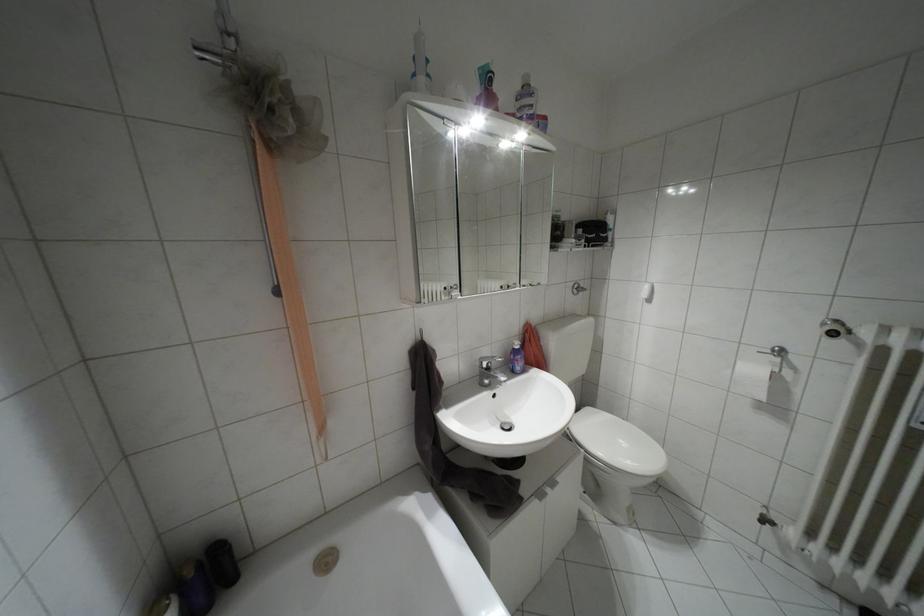
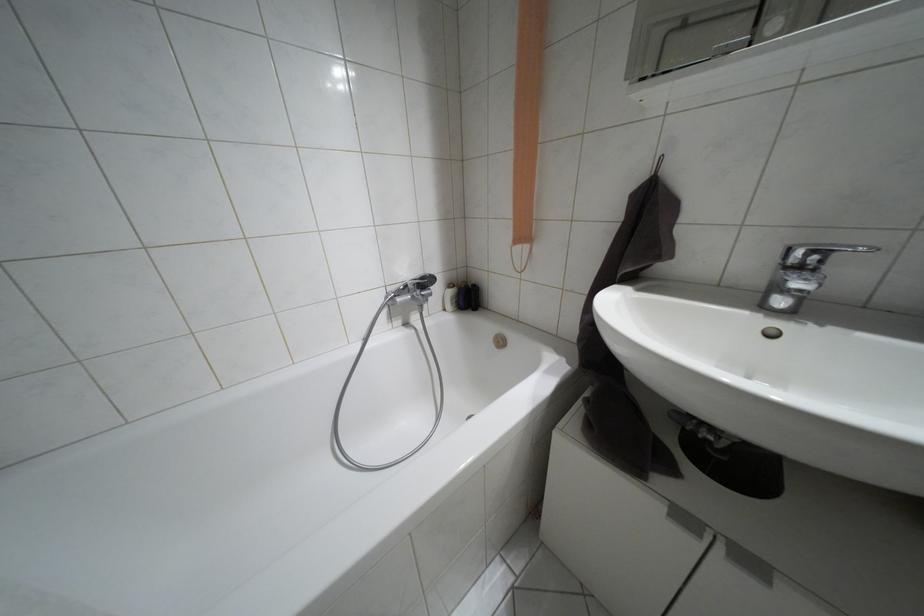
Where in the second image is the point corresponding to pixel 540 493 from the first image?

(684, 517)